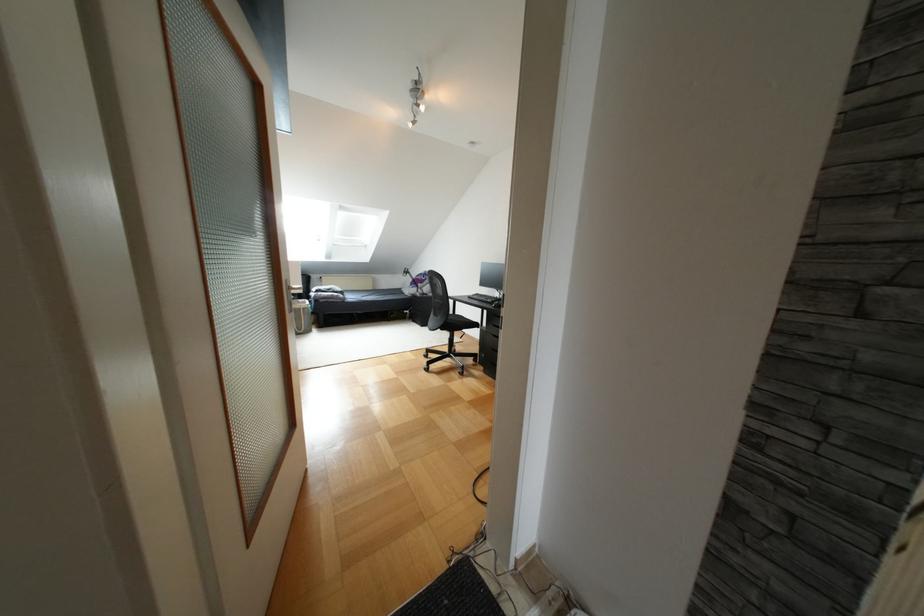
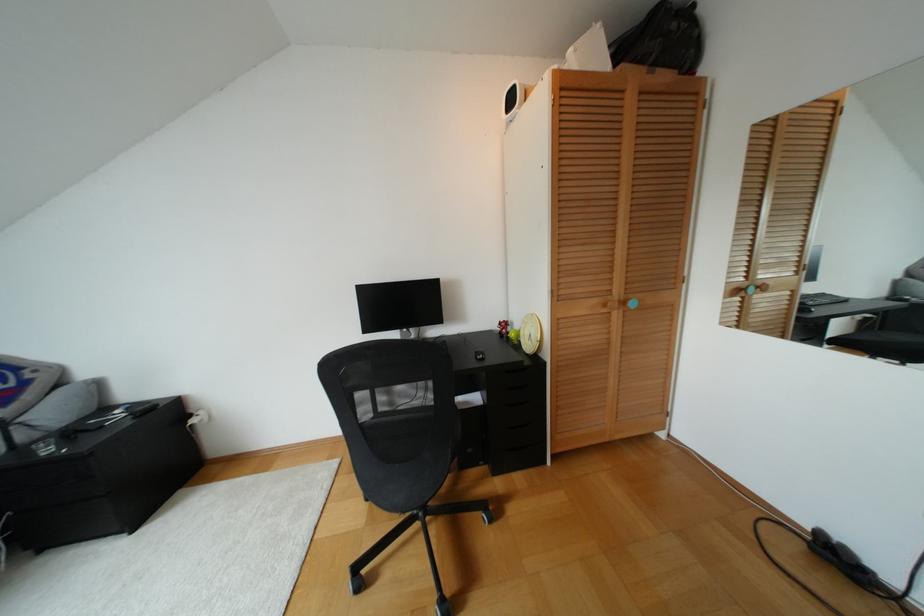
In the second image, find the point that corresponds to (426,355) in the first image.

(359, 585)